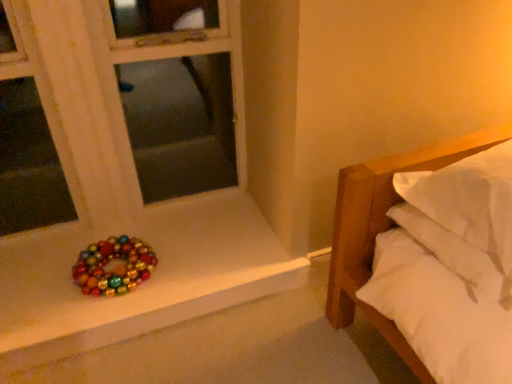
What is the approximate width of multicolored baubles at lower left?

multicolored baubles at lower left is 24.31 inches wide.

Identify the location of white soft bed at right. The width and height of the screenshot is (512, 384). (383, 229).

Describe the element at coordinates (114, 266) in the screenshot. I see `glossy multicolored beads at lower left` at that location.

Locate an element on the screen. Image resolution: width=512 pixels, height=384 pixels. multicolored baubles at lower left is located at coordinates (144, 283).

Based on the photo, can you tell me how much white soft bed at right and glossy multicolored beads at lower left differ in facing direction?

There is a 175-degree angle between the facing directions of white soft bed at right and glossy multicolored beads at lower left.

Who is more distant, white soft bed at right or glossy multicolored beads at lower left?

glossy multicolored beads at lower left is further from the camera.

Is white soft bed at right next to glossy multicolored beads at lower left and touching it?

No, white soft bed at right is not touching glossy multicolored beads at lower left.

From the image's perspective, which is above, white soft bed at right or glossy multicolored beads at lower left?

white soft bed at right, from the image's perspective.

Can you confirm if glossy multicolored beads at lower left is positioned to the left of white soft bed at right?

Indeed, glossy multicolored beads at lower left is positioned on the left side of white soft bed at right.

Measure the distance between glossy multicolored beads at lower left and white soft bed at right.

glossy multicolored beads at lower left and white soft bed at right are 36.04 inches apart.

Is glossy multicolored beads at lower left directly adjacent to white soft bed at right?

No, glossy multicolored beads at lower left is not in contact with white soft bed at right.

Is white soft bed at right at the back of glossy multicolored beads at lower left?

No, glossy multicolored beads at lower left is not facing away from white soft bed at right.

Is glossy multicolored beads at lower left at the right side of multicolored baubles at lower left?

Incorrect, glossy multicolored beads at lower left is not on the right side of multicolored baubles at lower left.

From a real-world perspective, between glossy multicolored beads at lower left and multicolored baubles at lower left, who is vertically higher?

From a 3D spatial view, glossy multicolored beads at lower left is above.

From the image's perspective, between glossy multicolored beads at lower left and multicolored baubles at lower left, who is located below?

glossy multicolored beads at lower left is shown below in the image.

I want to click on glass bead that is on the left side of multicolored baubles at lower left, so click(x=114, y=266).

Is multicolored baubles at lower left oriented away from white soft bed at right?

No, white soft bed at right is not at the back of multicolored baubles at lower left.

From the image's perspective, relative to white soft bed at right, is multicolored baubles at lower left above or below?

multicolored baubles at lower left is situated lower than white soft bed at right in the image.

Considering the relative positions of multicolored baubles at lower left and white soft bed at right in the image provided, is multicolored baubles at lower left to the left or to the right of white soft bed at right?

From the image, it's evident that multicolored baubles at lower left is to the left of white soft bed at right.

Does multicolored baubles at lower left have a lesser width compared to white soft bed at right?

Incorrect, the width of multicolored baubles at lower left is not less than that of white soft bed at right.

In the scene shown: Is multicolored baubles at lower left positioned beyond the bounds of glossy multicolored beads at lower left?

Yes, multicolored baubles at lower left is located beyond the bounds of glossy multicolored beads at lower left.

Where is `glass bead located on the left of multicolored baubles at lower left`? This screenshot has height=384, width=512. glass bead located on the left of multicolored baubles at lower left is located at coordinates (114, 266).

From a real-world perspective, does multicolored baubles at lower left sit lower than glossy multicolored beads at lower left?

Yes, from a real-world perspective, multicolored baubles at lower left is below glossy multicolored beads at lower left.

Is multicolored baubles at lower left far away from glossy multicolored beads at lower left?

No, multicolored baubles at lower left is in close proximity to glossy multicolored beads at lower left.

I want to click on window sill that appears below the white soft bed at right (from a real-world perspective), so click(144, 283).

In the scene shown: In the image, is white soft bed at right positioned in front of or behind multicolored baubles at lower left?

Visually, white soft bed at right is located in front of multicolored baubles at lower left.

Which point is more distant from viewer, [411,369] or [287,271]?

The point [287,271] is more distant.

Between white soft bed at right and multicolored baubles at lower left, which one has smaller width?

white soft bed at right is thinner.

At what (x,y) coordinates should I click in order to perform the action: click on glass bead directly beneath the white soft bed at right (from a real-world perspective). Please return your answer as a coordinate pair (x, y). Looking at the image, I should click on (114, 266).

Find the location of a particular element. The image size is (512, 384). bed to the right of glossy multicolored beads at lower left is located at coordinates point(383,229).

Looking at the image, which one is located further to white soft bed at right, glossy multicolored beads at lower left or multicolored baubles at lower left?

Among the two, glossy multicolored beads at lower left is located further to white soft bed at right.

Estimate the real-world distances between objects in this image. Which object is further from white soft bed at right, multicolored baubles at lower left or glossy multicolored beads at lower left?

Based on the image, glossy multicolored beads at lower left appears to be further to white soft bed at right.

From the image, which object appears to be farther from multicolored baubles at lower left, glossy multicolored beads at lower left or white soft bed at right?

white soft bed at right is further to multicolored baubles at lower left.

Looking at the image, which one is located further to glossy multicolored beads at lower left, multicolored baubles at lower left or white soft bed at right?

white soft bed at right lies further to glossy multicolored beads at lower left than the other object.

Considering their positions, is white soft bed at right positioned further to glossy multicolored beads at lower left than multicolored baubles at lower left?

white soft bed at right is further to glossy multicolored beads at lower left.

Looking at the image, which one is located closer to multicolored baubles at lower left, white soft bed at right or glossy multicolored beads at lower left?

The object closer to multicolored baubles at lower left is glossy multicolored beads at lower left.

The image size is (512, 384). I want to click on window sill located between glossy multicolored beads at lower left and white soft bed at right in the left-right direction, so click(x=144, y=283).